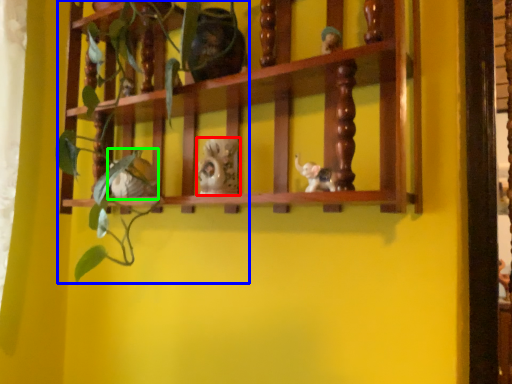
Question: Which object is positioned farthest from toy (highlighted by a red box)? Select from plant (highlighted by a blue box) and toy (highlighted by a green box).

Choices:
 (A) plant
 (B) toy

Answer: (A)